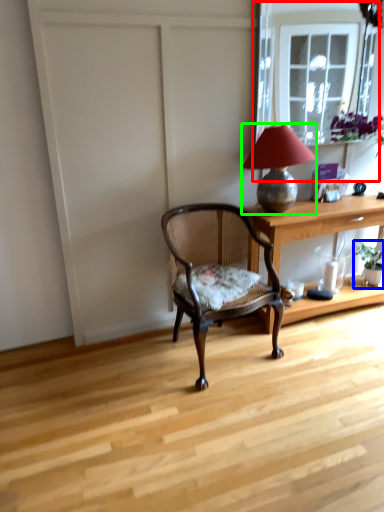
Question: Which object is positioned closest to window frame (highlighted by a red box)? Select from houseplant (highlighted by a blue box) and lamp (highlighted by a green box).

Choices:
 (A) houseplant
 (B) lamp

Answer: (A)